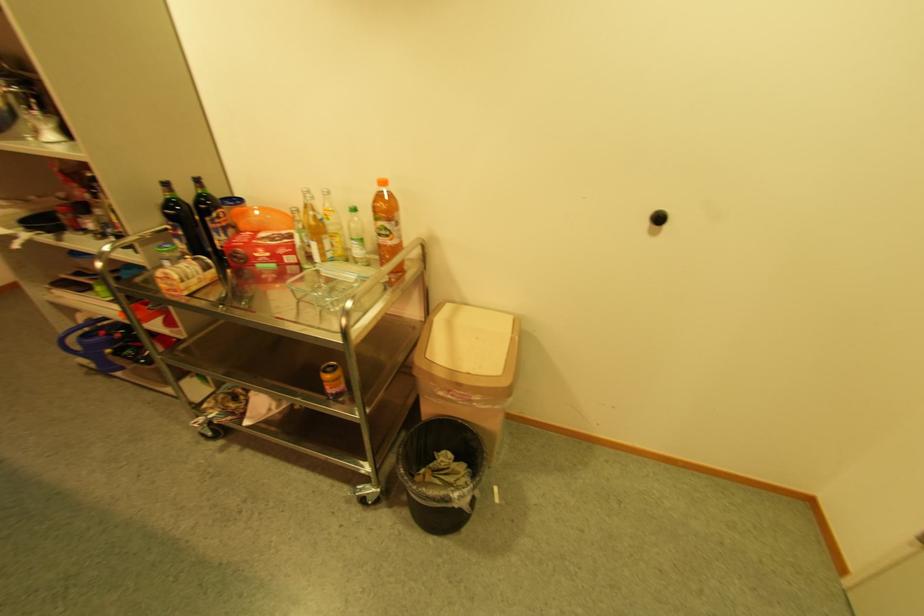
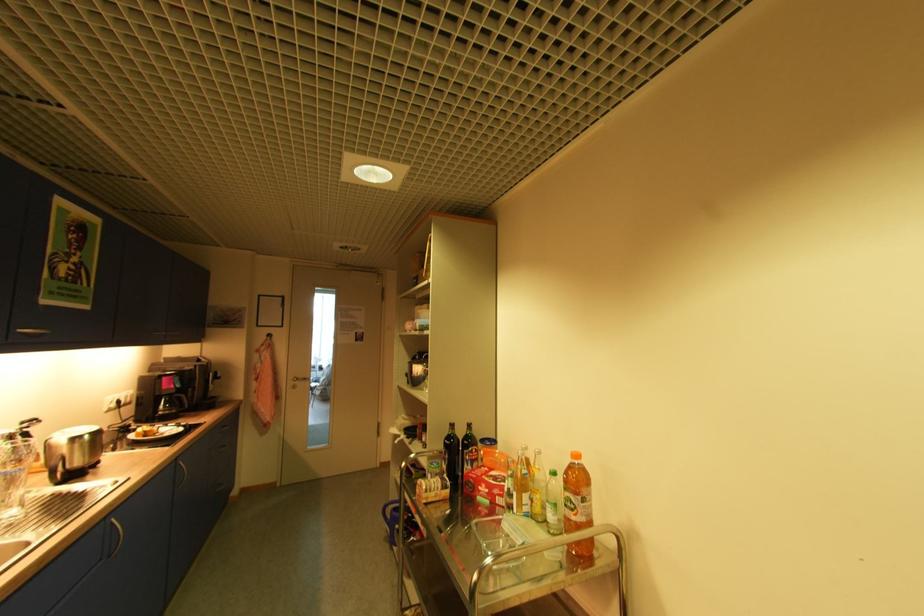
Find the pixel in the second image that matches the point at 172,217 in the first image.

(451, 445)